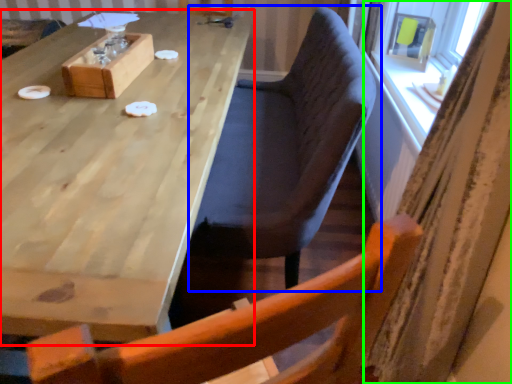
Question: Which object is the closest to the table (highlighted by a red box)? Choose among these: chair (highlighted by a blue box) or curtain (highlighted by a green box).

Choices:
 (A) chair
 (B) curtain

Answer: (A)